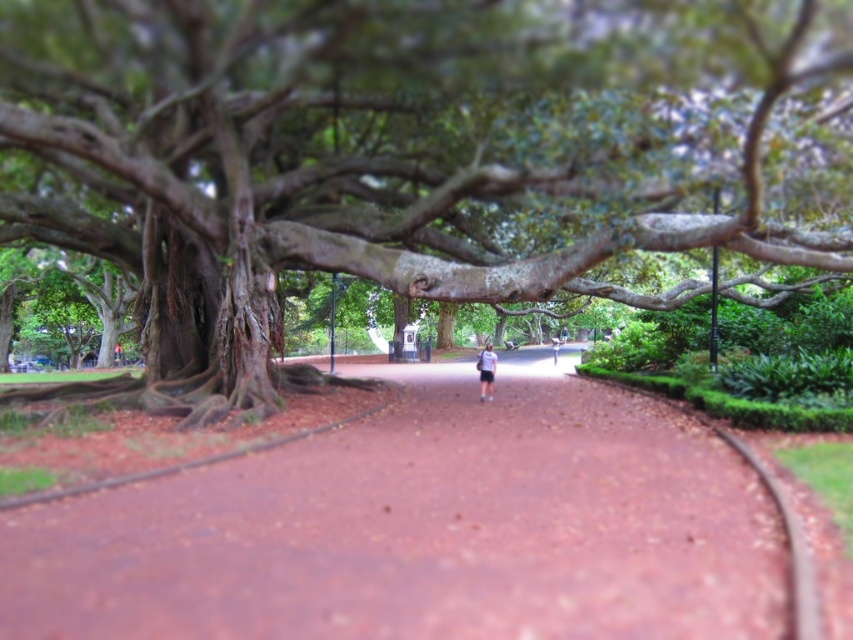
You are standing at the point labeled as point (424, 528) in the park. What surface are you currently standing on?

You are standing on the reddish brown concrete pavement at center, as the point (424, 528) is located there.